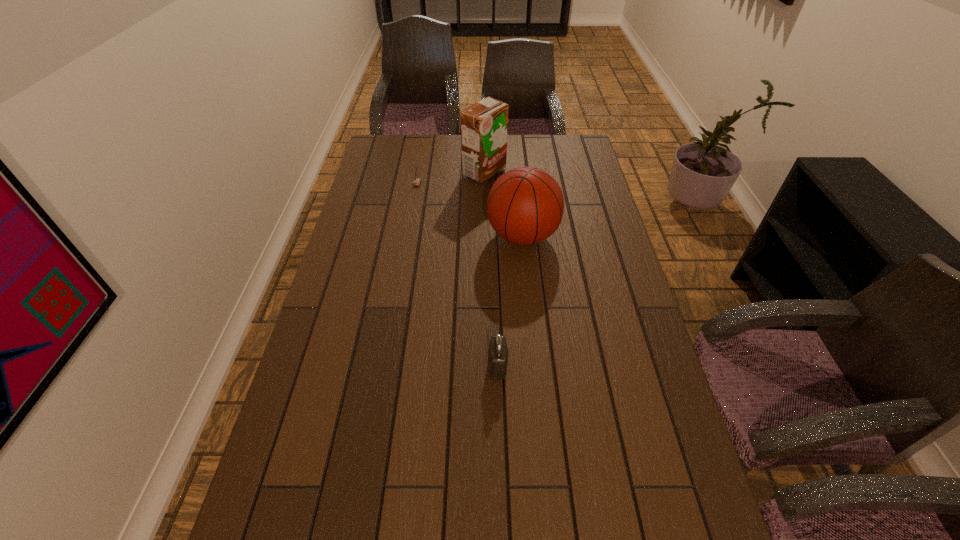
You are a GUI agent. You are given a task and a screenshot of the screen. Output one action in this format:
    pyautogui.click(x=<x>, y=<y>)
    Task: Click on the carton
    
    Given the screenshot: What is the action you would take?
    pyautogui.click(x=484, y=125)

Find the location of `the second nearest object`. the second nearest object is located at coordinates (525, 206).

The image size is (960, 540). I want to click on the third tallest object, so click(498, 352).

Find the location of `padlock`. padlock is located at coordinates point(498,352).

I want to click on the leftmost object, so click(416, 181).

Where is `matchbox`? The image size is (960, 540). matchbox is located at coordinates (416, 181).

Where is `free space located on the straw side of the carton`? free space located on the straw side of the carton is located at coordinates (372, 172).

The image size is (960, 540). I want to click on blank area located 0.090m on the straw side of the carton, so click(440, 172).

Where is `vacant region located 0.140m on the straw side of the carton`? The image size is (960, 540). vacant region located 0.140m on the straw side of the carton is located at coordinates (427, 172).

Find the location of `free space located on the front of the basketball`. free space located on the front of the basketball is located at coordinates (533, 336).